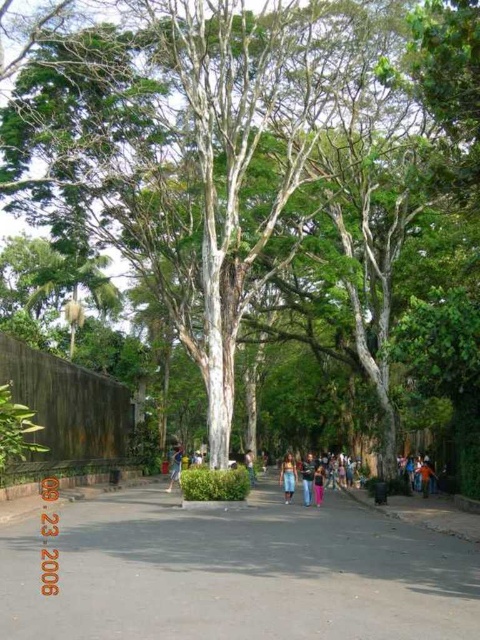
Question: Where is blue denim jeans at center located in relation to blue fabric shirt at center in the image?

Choices:
 (A) below
 (B) above

Answer: (A)

Question: Does blue fabric shirt at center have a greater width compared to orange fabric person at center?

Choices:
 (A) yes
 (B) no

Answer: (A)

Question: Can you confirm if blue fabric shirt at center is wider than pink fabric pants at center?

Choices:
 (A) yes
 (B) no

Answer: (A)

Question: Which object appears closest to the camera in this image?

Choices:
 (A) gray asphalt pavement at center
 (B) light brown leather jacket at center
 (C) blue denim jeans at center
 (D) pink fabric pants at center

Answer: (A)

Question: Which of the following is the farthest from the observer?

Choices:
 (A) light brown leather jacket at center
 (B) blue denim jeans at center
 (C) gray asphalt pavement at center
 (D) denim pants at center

Answer: (A)

Question: Which object appears closest to the camera in this image?

Choices:
 (A) orange fabric person at center
 (B) pink fabric pants at center

Answer: (B)